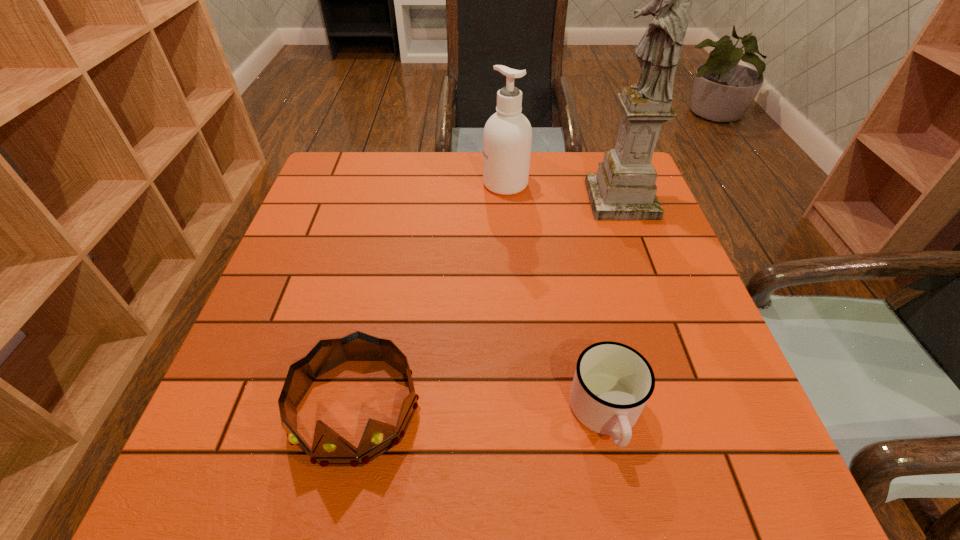
At what (x,y) coordinates should I click in order to perform the action: click on the tallest object. Please return your answer as a coordinate pair (x, y). Image resolution: width=960 pixels, height=540 pixels. Looking at the image, I should click on (624, 188).

You are a GUI agent. You are given a task and a screenshot of the screen. Output one action in this format:
    pyautogui.click(x=<x>, y=<y>)
    Task: Click on the rightmost object
    The width and height of the screenshot is (960, 540).
    Given the screenshot: What is the action you would take?
    pyautogui.click(x=624, y=188)

Identify the location of the third object from right to left. (507, 138).

Image resolution: width=960 pixels, height=540 pixels. Identify the location of cleansing agent. (507, 138).

The image size is (960, 540). I want to click on the third tallest object, so click(x=329, y=449).

You are a GUI agent. You are given a task and a screenshot of the screen. Output one action in this format:
    pyautogui.click(x=<x>, y=<y>)
    Task: Click on the tiara
    
    Given the screenshot: What is the action you would take?
    pyautogui.click(x=329, y=449)

The width and height of the screenshot is (960, 540). Find the location of `mug`. mug is located at coordinates (612, 383).

This screenshot has height=540, width=960. I want to click on the shortest object, so click(612, 383).

You are a GUI agent. You are given a task and a screenshot of the screen. Output one action in this format:
    pyautogui.click(x=<x>, y=<y>)
    Task: Click on the vacant space located 0.400m on the front-facing side of the rightmost object
    Image resolution: width=960 pixels, height=540 pixels.
    Given the screenshot: What is the action you would take?
    pyautogui.click(x=441, y=200)

Locate an element on the screen. Image resolution: width=960 pixels, height=540 pixels. blank area located 0.230m on the front-facing side of the rightmost object is located at coordinates (504, 200).